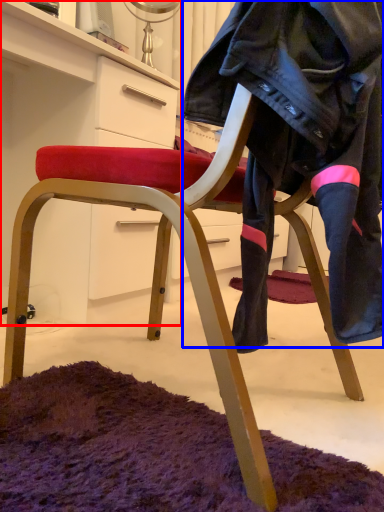
Question: Which object is further to the camera taking this photo, cabinetry (highlighted by a red box) or leather jacket (highlighted by a blue box)?

Choices:
 (A) cabinetry
 (B) leather jacket

Answer: (A)